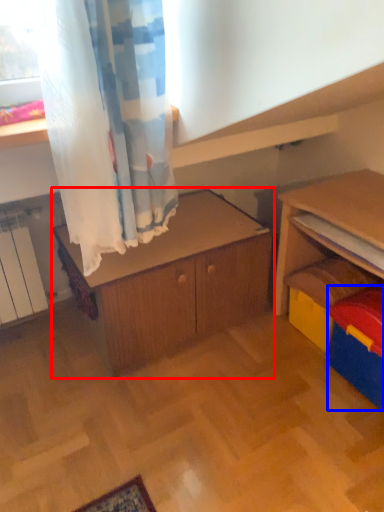
Question: Which object appears farthest to the camera in this image, cabinetry (highlighted by a red box) or storage box (highlighted by a blue box)?

Choices:
 (A) cabinetry
 (B) storage box

Answer: (A)